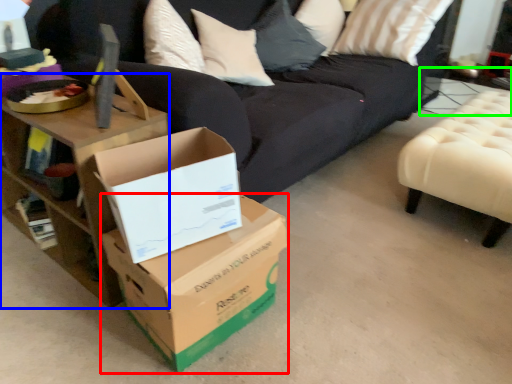
Question: Which object is positioned farthest from box (highlighted by a red box)? Select from table (highlighted by a blue box) and side table (highlighted by a green box).

Choices:
 (A) table
 (B) side table

Answer: (B)